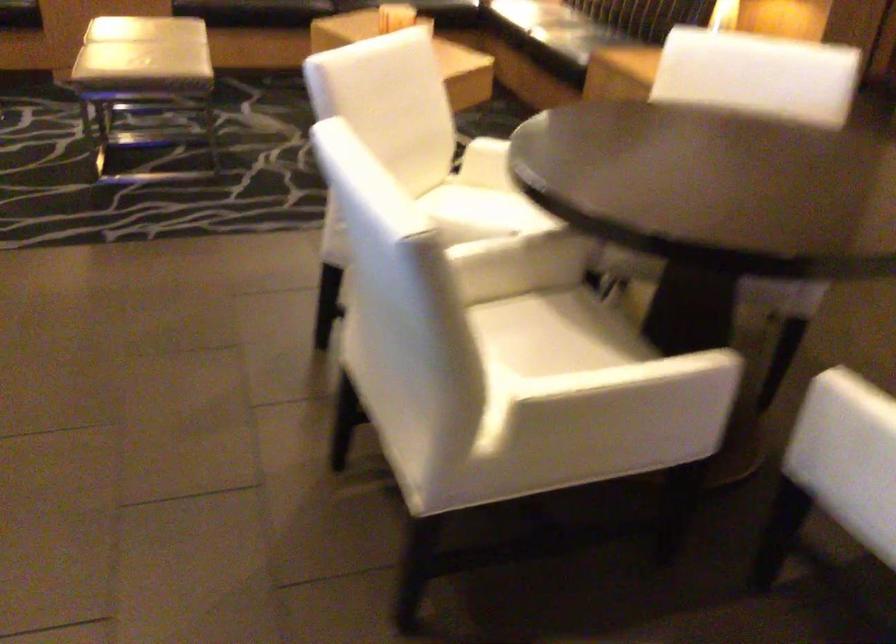
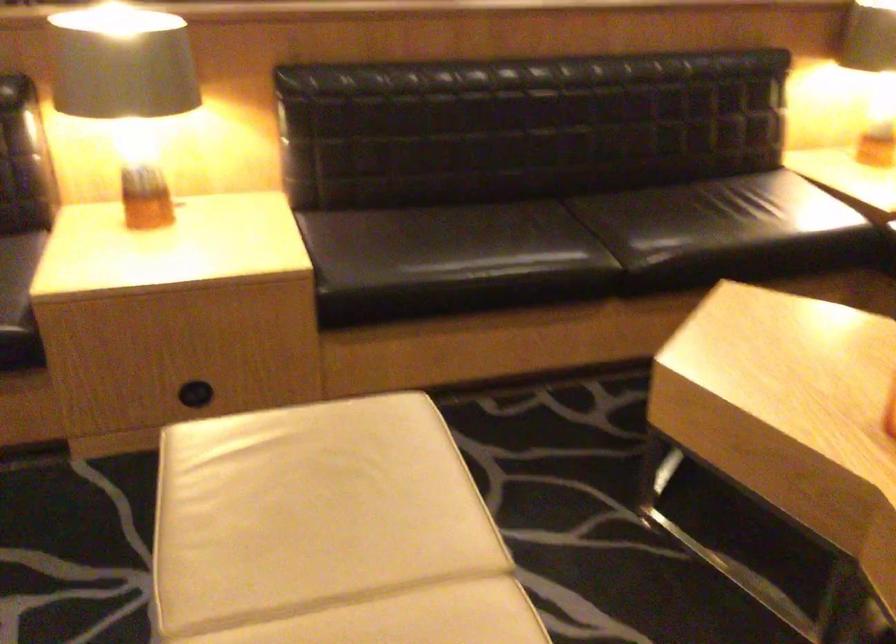
What movement of the cameraman would produce the second image?

The movement direction of the cameraman is left, forward.